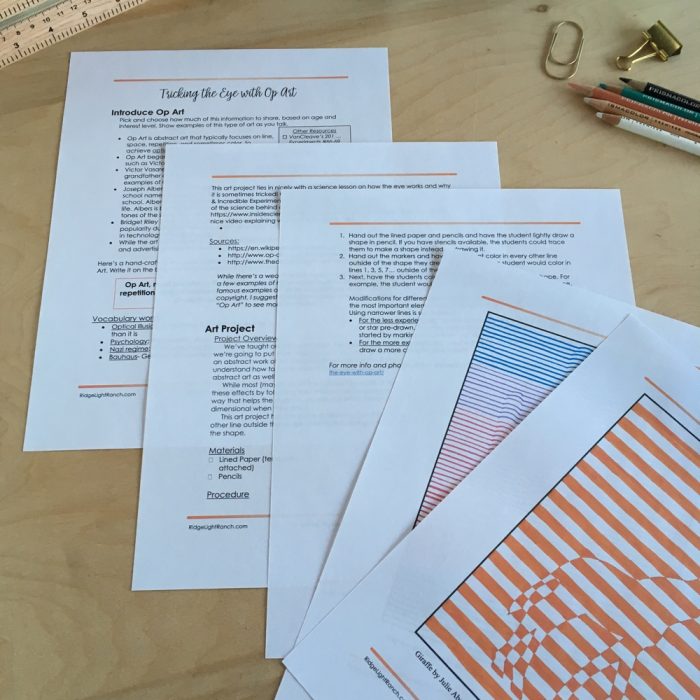
Identify the location of table surface background. (46, 526), (496, 36).